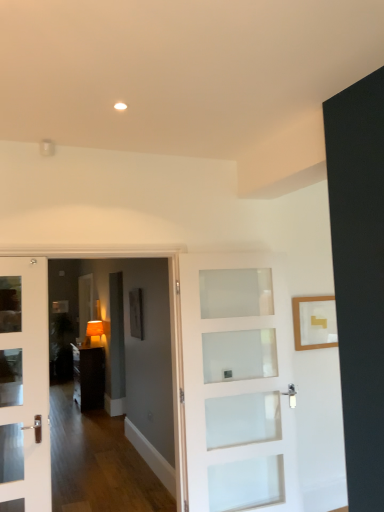
Question: In the image, is dark wood cabinet at center on the left side or the right side of white frosted glass door at center?

Choices:
 (A) right
 (B) left

Answer: (B)

Question: Is dark wood cabinet at center taller or shorter than white frosted glass door at center?

Choices:
 (A) tall
 (B) short

Answer: (B)

Question: Which object is the closest to the wooden picture frame at upper right, acting as the first picture frame starting from the front?

Choices:
 (A) dark wood cabinet at center
 (B) matte orange lampshade at center
 (C) white frosted glass door at center
 (D) matte black picture frame at center, placed as the second picture frame when sorted from right to left

Answer: (C)

Question: Estimate the real-world distances between objects in this image. Which object is farther from the matte black picture frame at center, placed as the second picture frame when sorted from right to left?

Choices:
 (A) dark wood cabinet at center
 (B) wooden picture frame at upper right, which is counted as the 1th picture frame, starting from the right
 (C) matte orange lampshade at center
 (D) white frosted glass door at center

Answer: (C)